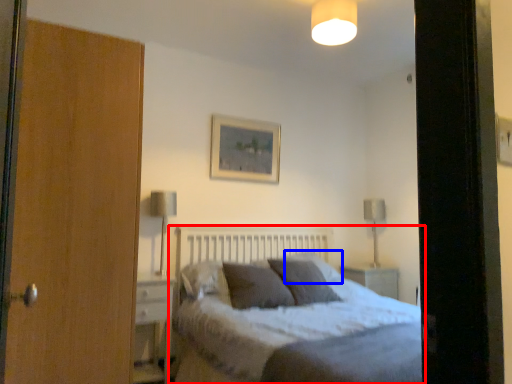
Question: Which point is further to the camera, bed (highlighted by a red box) or pillow (highlighted by a blue box)?

Choices:
 (A) bed
 (B) pillow

Answer: (B)